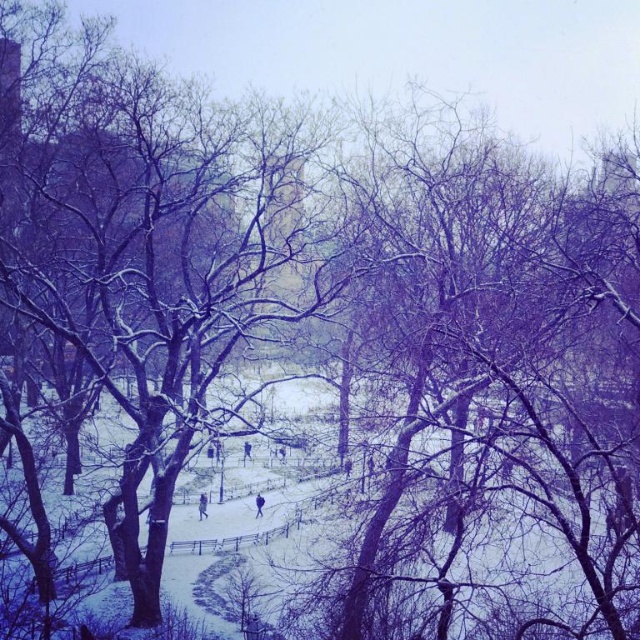
Can you confirm if purple fabric person at lower center is positioned to the right of blue fabric jacket at center?

Incorrect, purple fabric person at lower center is not on the right side of blue fabric jacket at center.

Between purple fabric person at lower center and blue fabric jacket at center, which one is positioned lower?

purple fabric person at lower center is lower down.

Who is more distant from viewer, [204,508] or [259,500]?

Positioned behind is point [204,508].

Locate an element on the screen. purple fabric person at lower center is located at coordinates click(x=202, y=506).